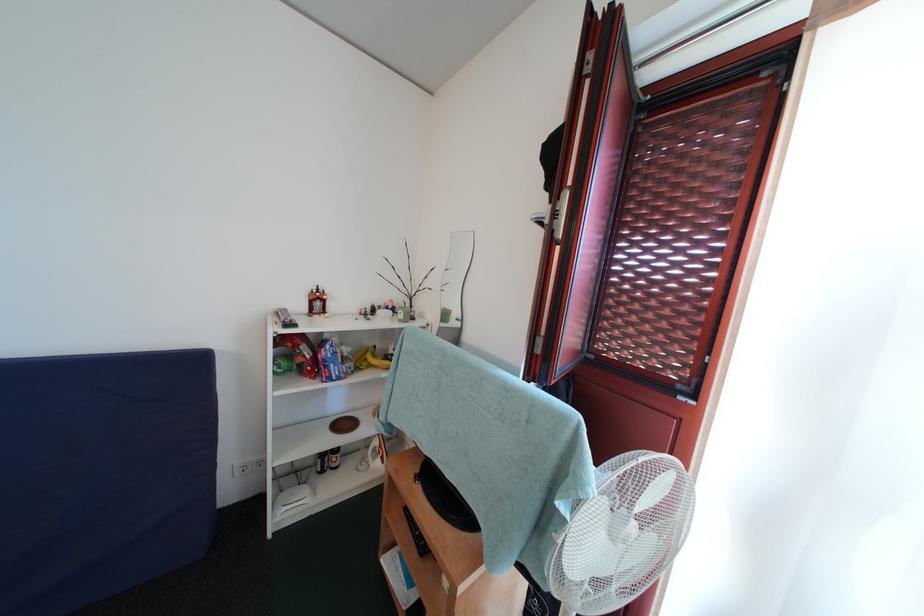
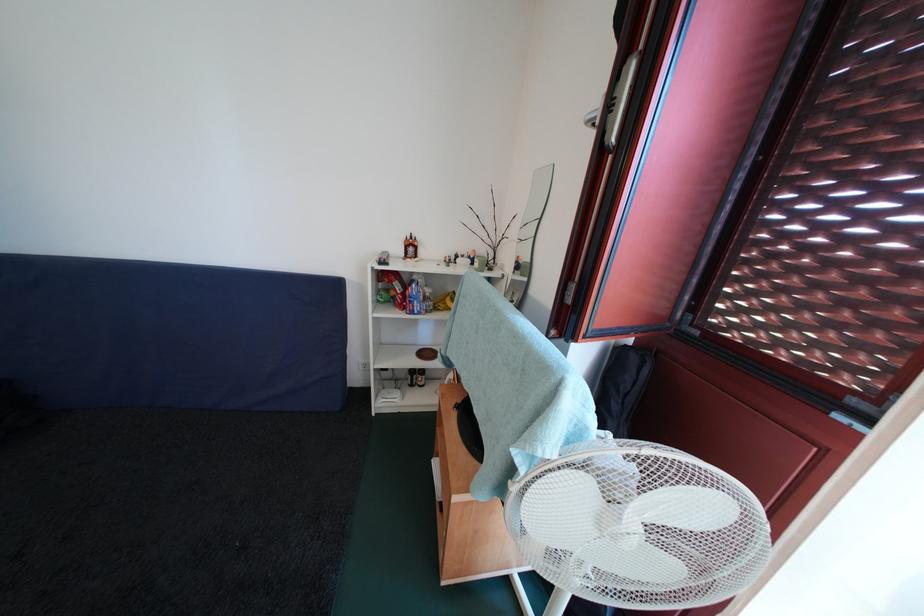
In the second image, find the point that corresponds to the point at 322,296 in the first image.

(416, 243)